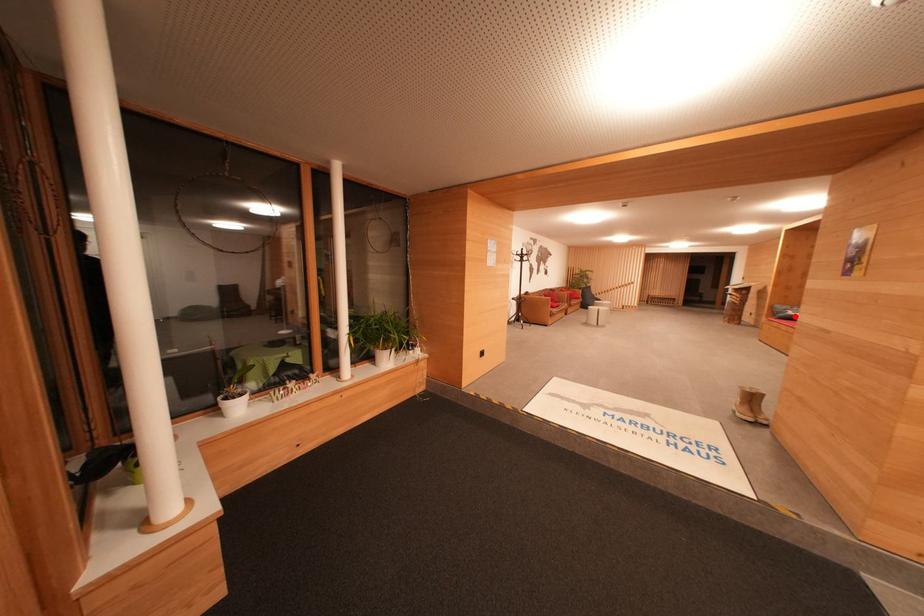
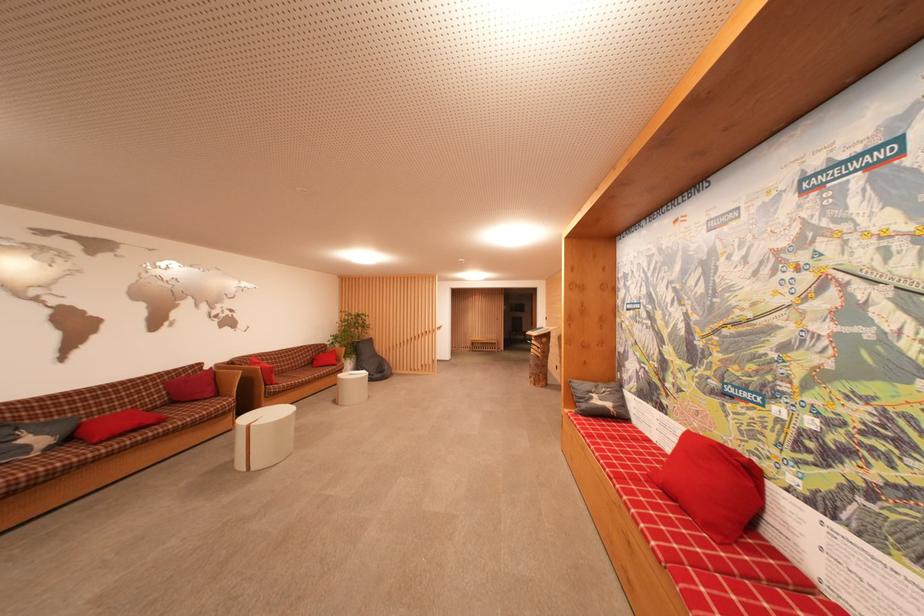
The point at the highlighted location is marked in the first image. Where is the corresponding point in the second image?

(601, 405)